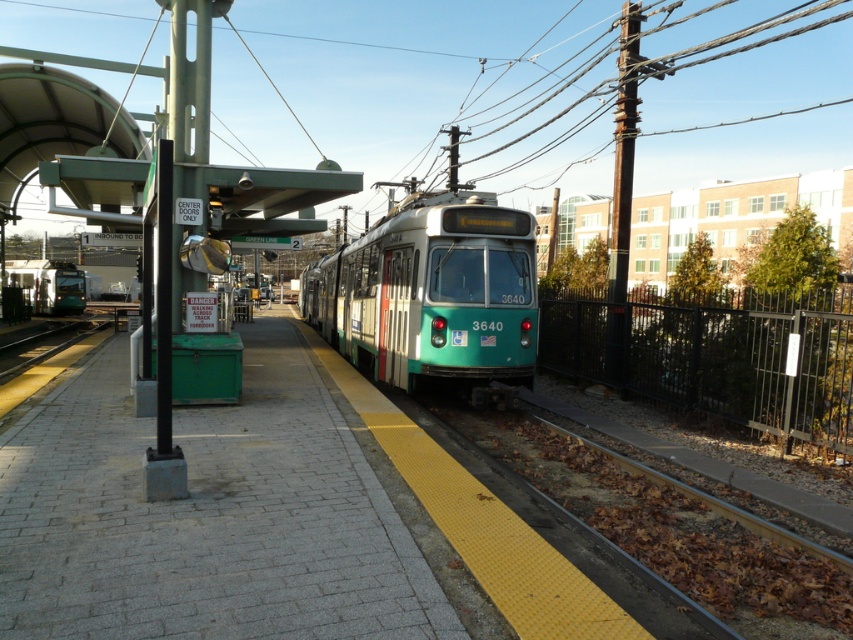
Question: Which point appears farthest from the camera in this image?

Choices:
 (A) (21, 285)
 (B) (282, 428)
 (C) (422, 323)

Answer: (A)

Question: Does green matte train at center come in front of green matte train at left?

Choices:
 (A) yes
 (B) no

Answer: (A)

Question: Which point is closer to the camera?

Choices:
 (A) brick platform at center
 (B) green matte train at left
 (C) green matte train at center

Answer: (A)

Question: Is brick platform at center positioned in front of green matte train at left?

Choices:
 (A) yes
 (B) no

Answer: (A)

Question: Which object is the farthest from the green matte train at center?

Choices:
 (A) brick platform at center
 (B) green matte train at left

Answer: (B)

Question: Can you confirm if green matte train at center is wider than green matte train at left?

Choices:
 (A) no
 (B) yes

Answer: (A)